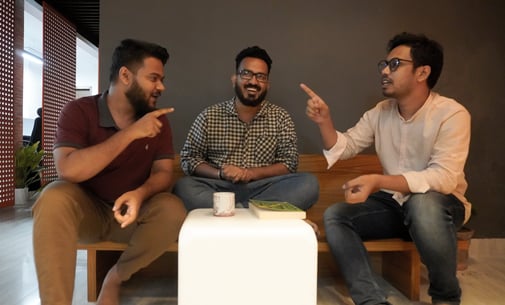
Where is `planter`? The width and height of the screenshot is (505, 305). planter is located at coordinates (22, 197).